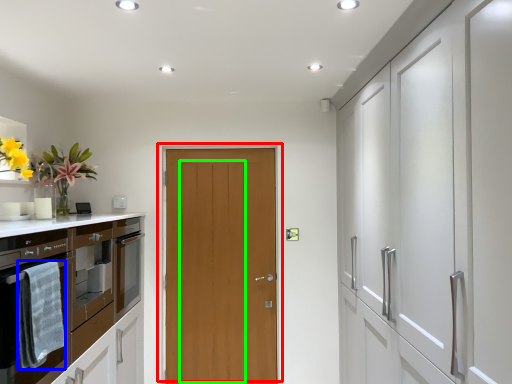
Question: Which object is the farthest from door (highlighted by a red box)? Choose among these: material (highlighted by a blue box) or door (highlighted by a green box).

Choices:
 (A) material
 (B) door

Answer: (A)